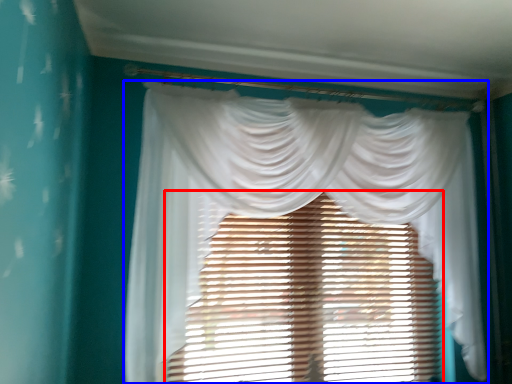
Question: Which of the following is the closest to the observer, window blind (highlighted by a red box) or curtain (highlighted by a blue box)?

Choices:
 (A) window blind
 (B) curtain

Answer: (B)